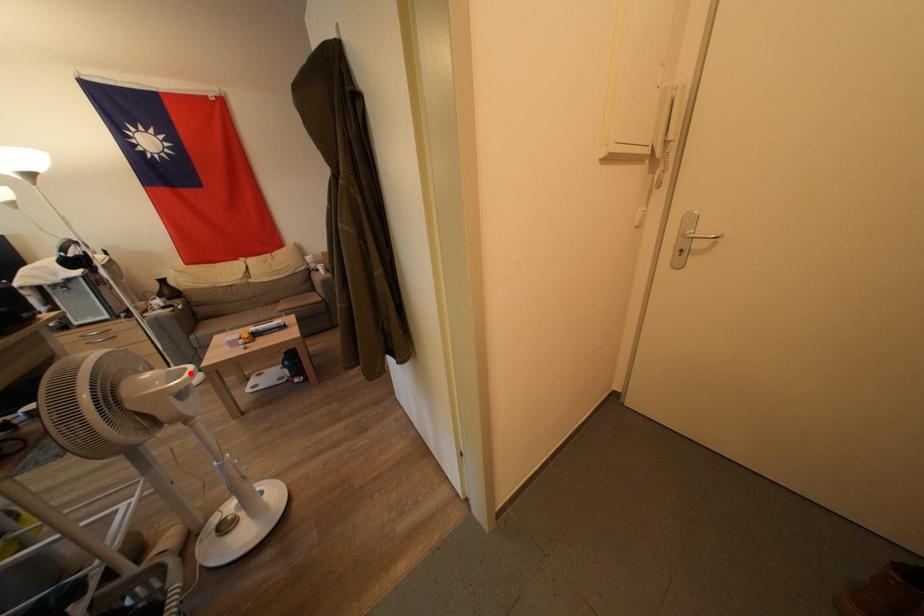
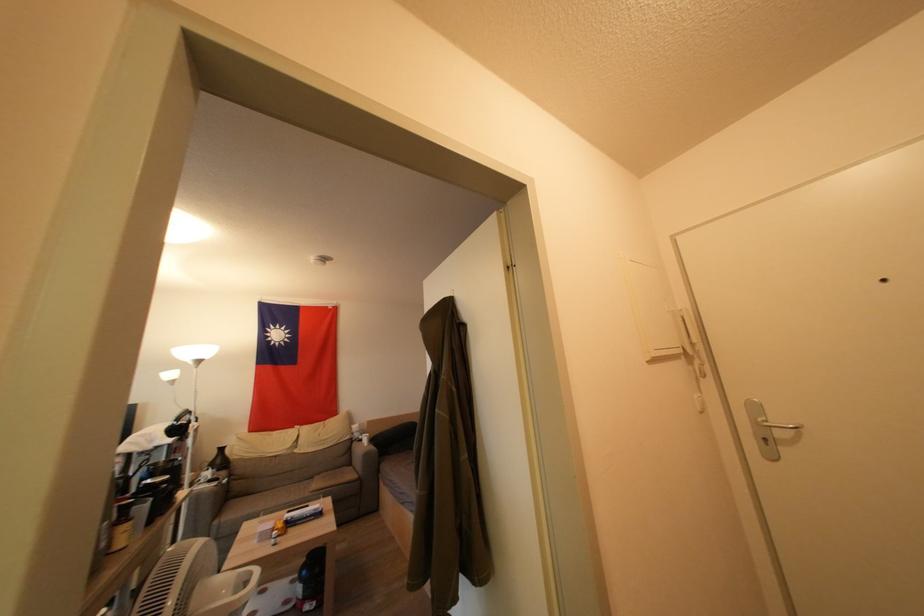
Question: I am providing you with two images of the same scene from different viewpoints. In image1, a red point is highlighted. Considering the same 3D point in image2, which of the following is correct?

Choices:
 (A) It is closer
 (B) It is farther

Answer: (B)